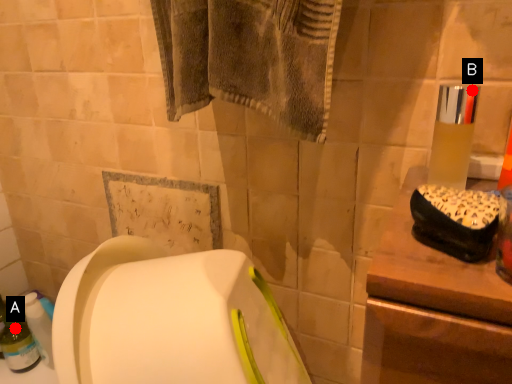
Question: Two points are circled on the image, labeled by A and B beside each circle. Among these points, which one is nearest to the camera?

Choices:
 (A) A is closer
 (B) B is closer

Answer: (B)